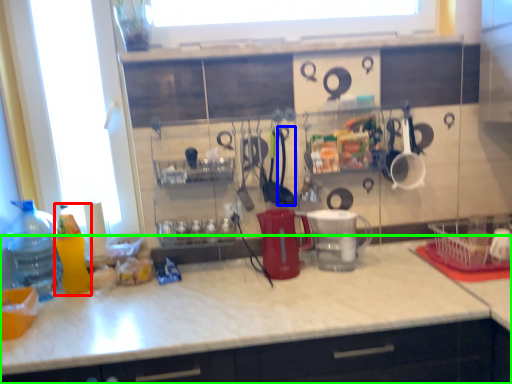
Question: Considering the real-world distances, which object is farthest from bottle (highlighted by a red box)? tableware (highlighted by a blue box) or countertop (highlighted by a green box)?

Choices:
 (A) tableware
 (B) countertop

Answer: (A)